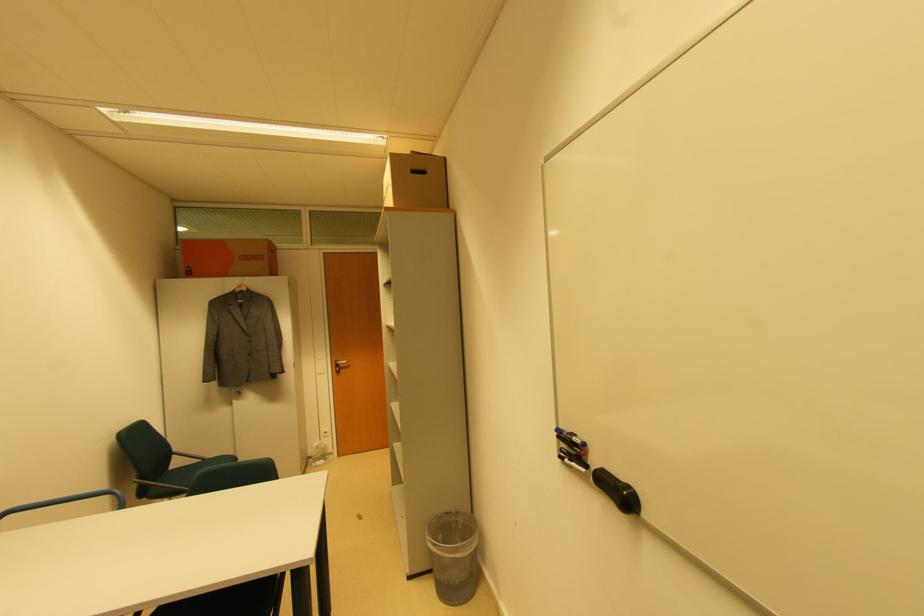
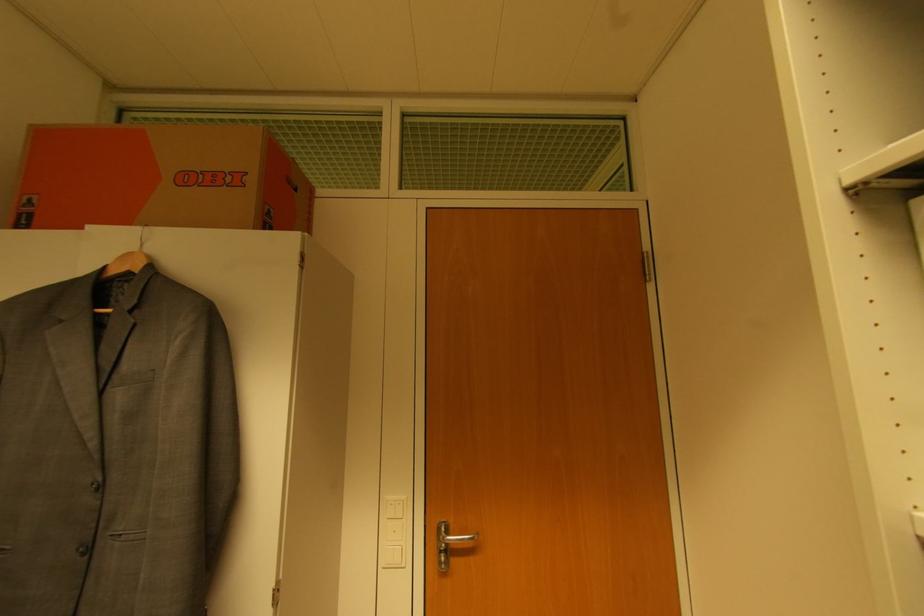
The images are taken continuously from a first-person perspective. In which direction are you moving?

The cameraman walked toward left, forward.